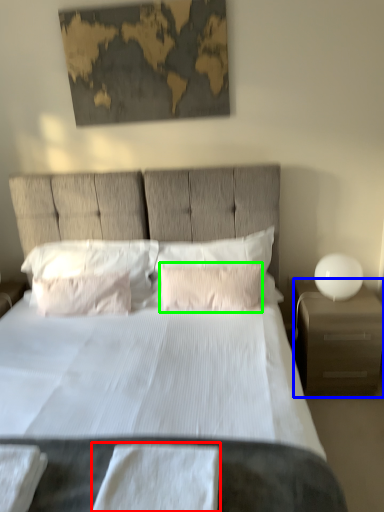
Question: Which object is the closest to the sheet (highlighted by a red box)? Choose among these: nightstand (highlighted by a blue box) or pillow (highlighted by a green box).

Choices:
 (A) nightstand
 (B) pillow

Answer: (B)